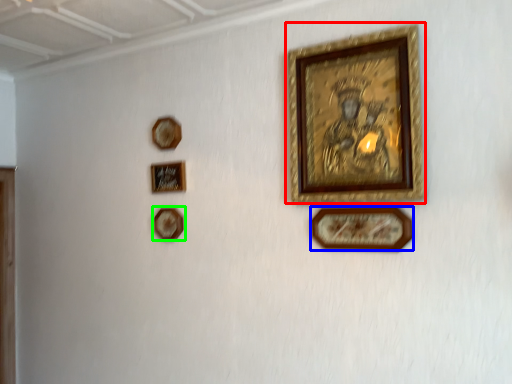
Question: Based on their relative distances, which object is nearer to picture frame (highlighted by a red box)? Choose from picture frame (highlighted by a blue box) and picture frame (highlighted by a green box).

Choices:
 (A) picture frame
 (B) picture frame

Answer: (A)